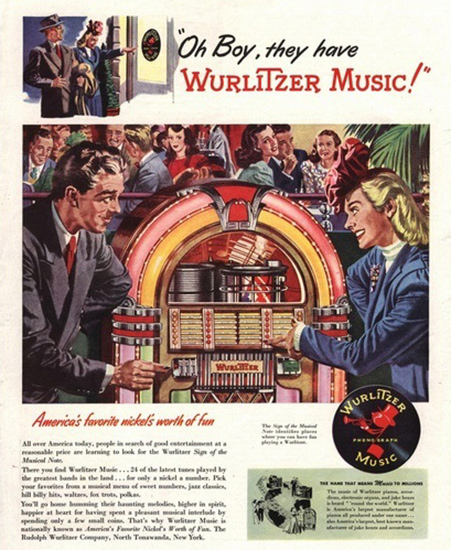
Find the location of a particular element. The height and width of the screenshot is (550, 451). jukebox is located at coordinates (286, 236).